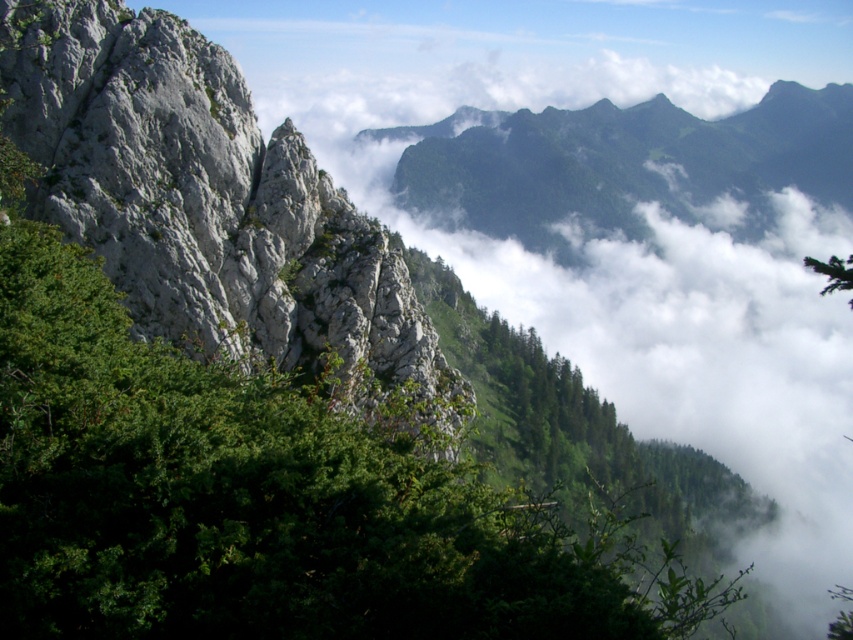
Question: Among these objects, which one is farthest from the camera?

Choices:
 (A) green leafy tree at upper right
 (B) gray rough rock at left

Answer: (B)

Question: Is gray rough rock at left to the left of green leafy tree at upper right from the viewer's perspective?

Choices:
 (A) no
 (B) yes

Answer: (B)

Question: Is gray rough rock at left positioned behind green leafy tree at upper right?

Choices:
 (A) yes
 (B) no

Answer: (A)

Question: Is gray rough rock at left smaller than green leafy tree at upper right?

Choices:
 (A) yes
 (B) no

Answer: (A)

Question: Which of the following is the farthest from the observer?

Choices:
 (A) gray rough rock at left
 (B) green leafy tree at upper right

Answer: (A)